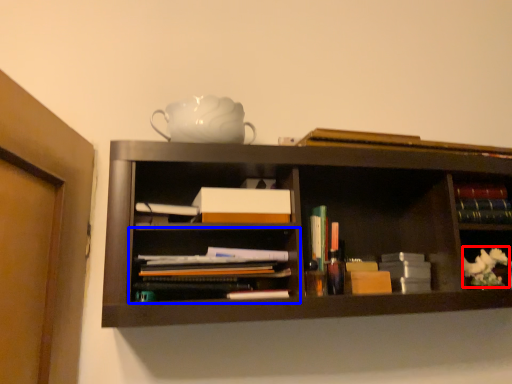
Question: Which of the following is the farthest to the observer, flower (highlighted by a red box) or shelf (highlighted by a blue box)?

Choices:
 (A) flower
 (B) shelf

Answer: (A)